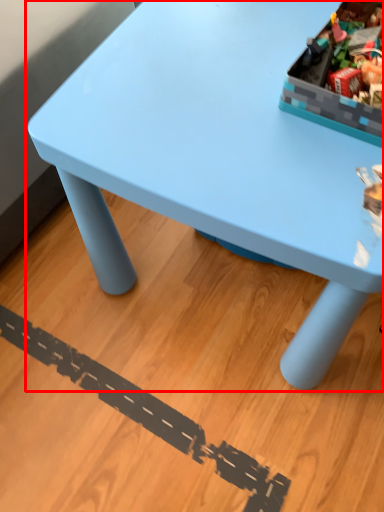
Question: From the image's perspective, what is the correct spatial positioning of table (annotated by the red box) in reference to storage box?

Choices:
 (A) below
 (B) above

Answer: (A)